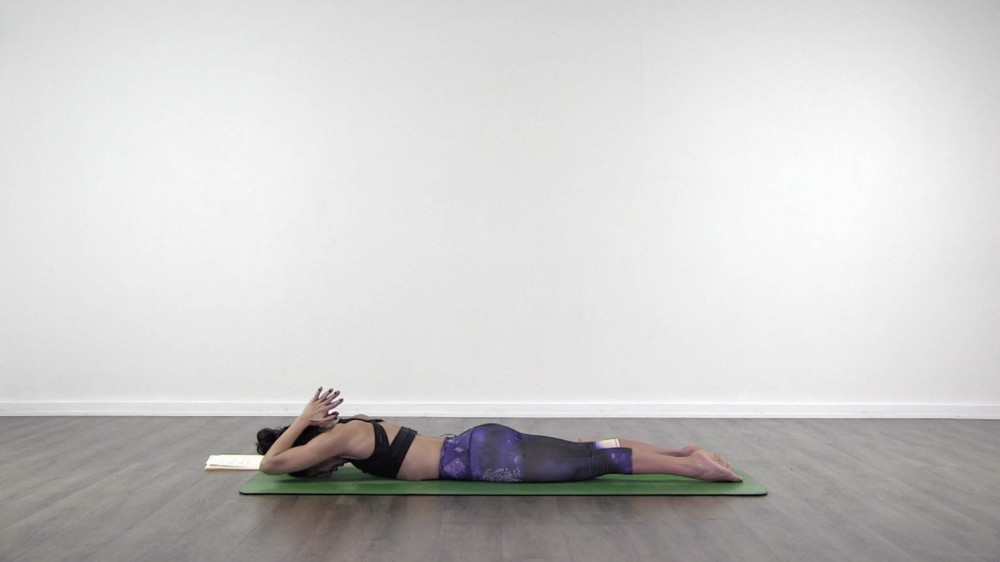
This screenshot has height=562, width=1000. Identify the location of floor. (861, 488).